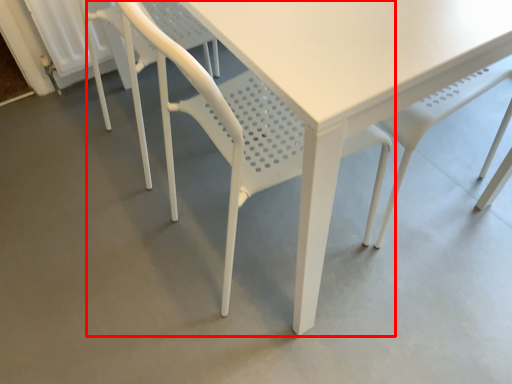
Question: From the image's perspective, where is chair (annotated by the red box) located in relation to chair in the image?

Choices:
 (A) below
 (B) above

Answer: (A)